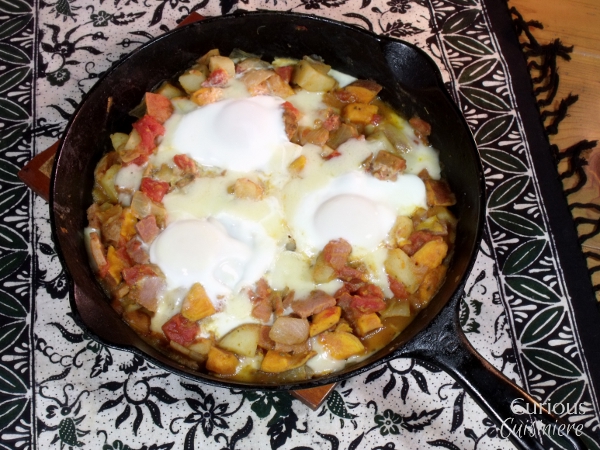
Where is `table`? The width and height of the screenshot is (600, 450). table is located at coordinates (548, 19).